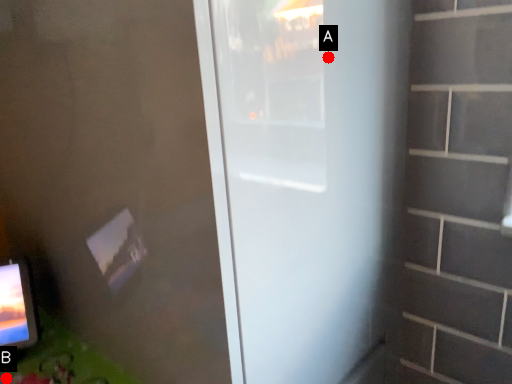
Question: Two points are circled on the image, labeled by A and B beside each circle. Which point is closer to the camera?

Choices:
 (A) A is closer
 (B) B is closer

Answer: (A)